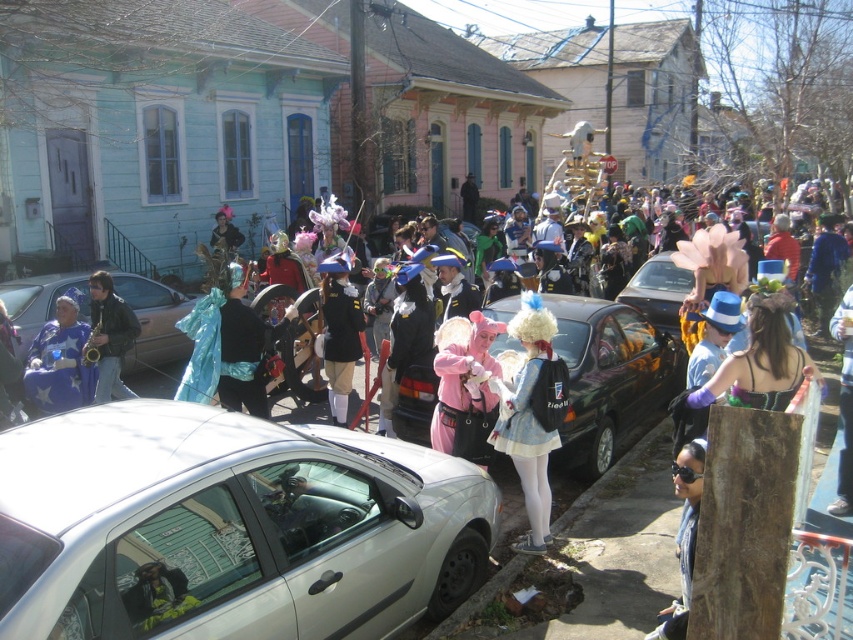
Does shiny black uniform at center come in front of black leather jacket at left?

No, it is behind black leather jacket at left.

Between point (328, 384) and point (108, 371), which one is positioned behind?

Positioned behind is point (328, 384).

Where is `shiny black uniform at center`? This screenshot has height=640, width=853. shiny black uniform at center is located at coordinates (339, 330).

Is black matte car at center behind white matte dress at center?

Yes, it is.

Does black matte car at center have a greater width compared to white matte dress at center?

Yes.

What do you see at coordinates (608, 378) in the screenshot? I see `black matte car at center` at bounding box center [608, 378].

This screenshot has height=640, width=853. Find the location of `black matte car at center`. black matte car at center is located at coordinates (608, 378).

Which is behind, point (593, 378) or point (94, 294)?

Point (94, 294)

Does black matte car at center have a smaller size compared to black leather jacket at left?

No, black matte car at center is not smaller than black leather jacket at left.

Is point (668, 342) positioned after point (119, 365)?

Yes, point (668, 342) is farther from viewer.

The width and height of the screenshot is (853, 640). In order to click on black matte car at center in this screenshot , I will do `click(608, 378)`.